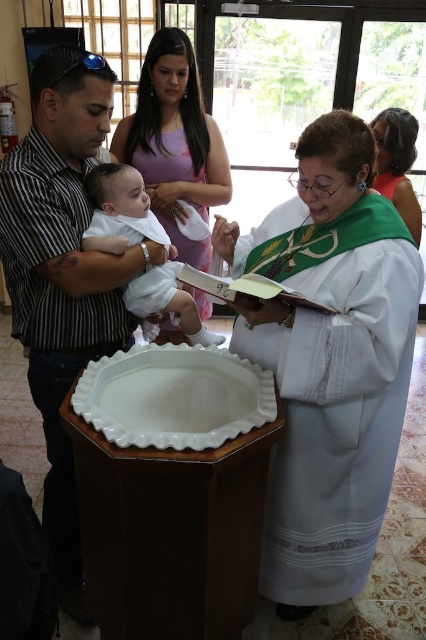
Question: Is matte black shirt at left to the right of matte pink dress at upper center from the viewer's perspective?

Choices:
 (A) no
 (B) yes

Answer: (A)

Question: Among these points, which one is farthest from the camera?

Choices:
 (A) (135, 403)
 (B) (209, 308)

Answer: (B)

Question: Which point is farther from the camera taking this photo?

Choices:
 (A) click(124, 269)
 (B) click(109, 230)
 (C) click(405, 109)
 (D) click(117, 138)

Answer: (C)

Question: Is white cloth robe at center wider than white matte robe at center?

Choices:
 (A) no
 (B) yes

Answer: (B)

Question: Among these points, which one is farthest from the camera?

Choices:
 (A) (184, 244)
 (B) (236, 371)
 (C) (316, 460)
 (D) (403, 195)

Answer: (A)

Question: Can you confirm if white cloth robe at center is positioned above white glossy tray at center?

Choices:
 (A) no
 (B) yes

Answer: (A)